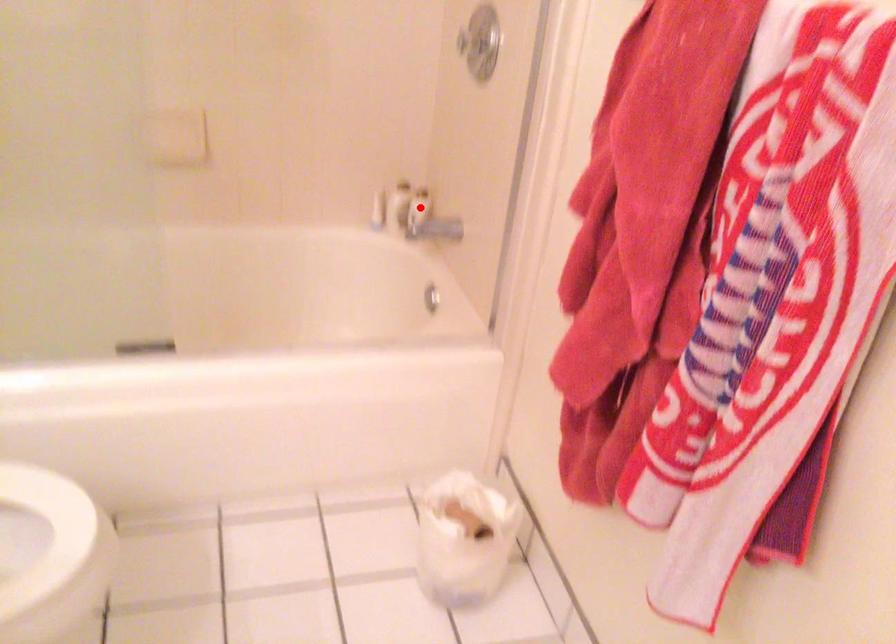
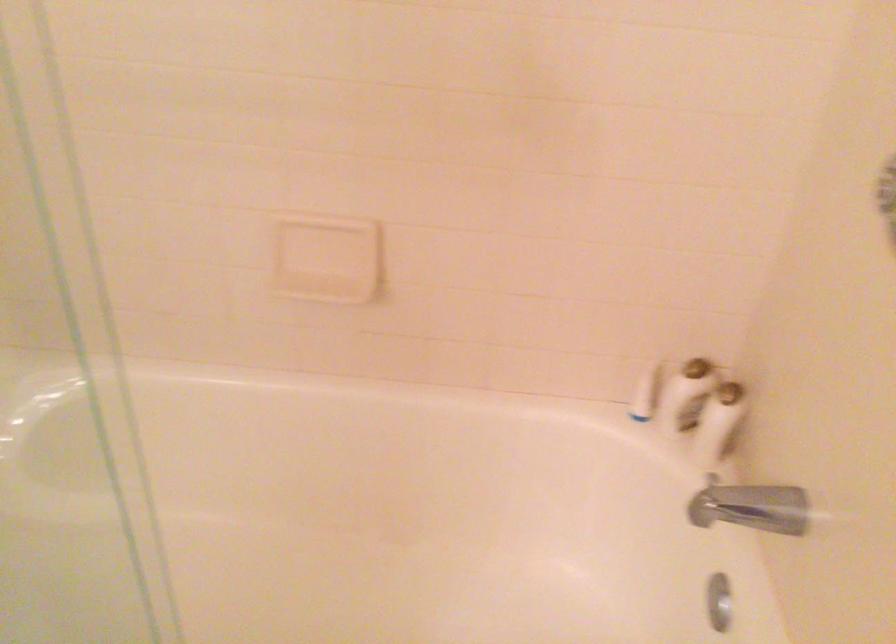
Find the pixel in the second image that matches the highlighted location in the first image.

(718, 422)